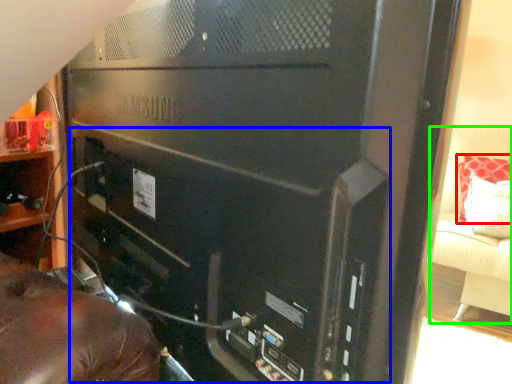
Question: Estimate the real-world distances between objects in this image. Which object is closer to pillow (highlighted by a red box), computer tower (highlighted by a blue box) or furniture (highlighted by a green box)?

Choices:
 (A) computer tower
 (B) furniture

Answer: (B)